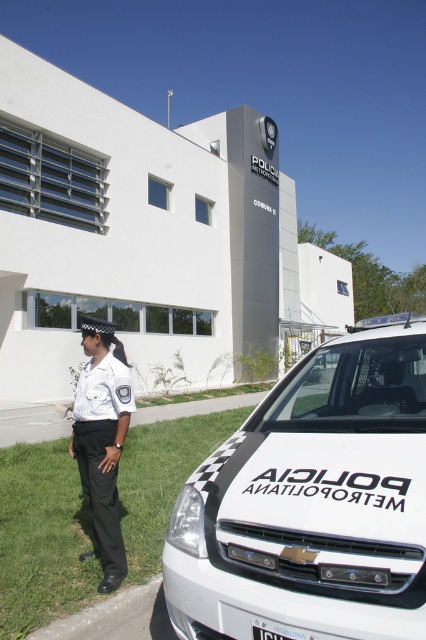
You are a visitor arriving at the Policja Metropolitana facility. You see a white glossy van at lower right and a white uniform at center. Which object is physically larger in size?

The white glossy van at lower right is bigger than the white uniform at center.

You are a delivery driver who needs to park your vehicle at the police station. The parking lot has a restricted area marked at coordinates between 0.7 and 0.8 on the x and y axes. Is the white glossy van at lower right parked within this restricted area?

The white glossy van at lower right is parked at coordinates 0.787 and 0.735, which falls within the restricted area marked between 0.7 and 0.8 on both axes. Therefore, the van is parked in the restricted zone.